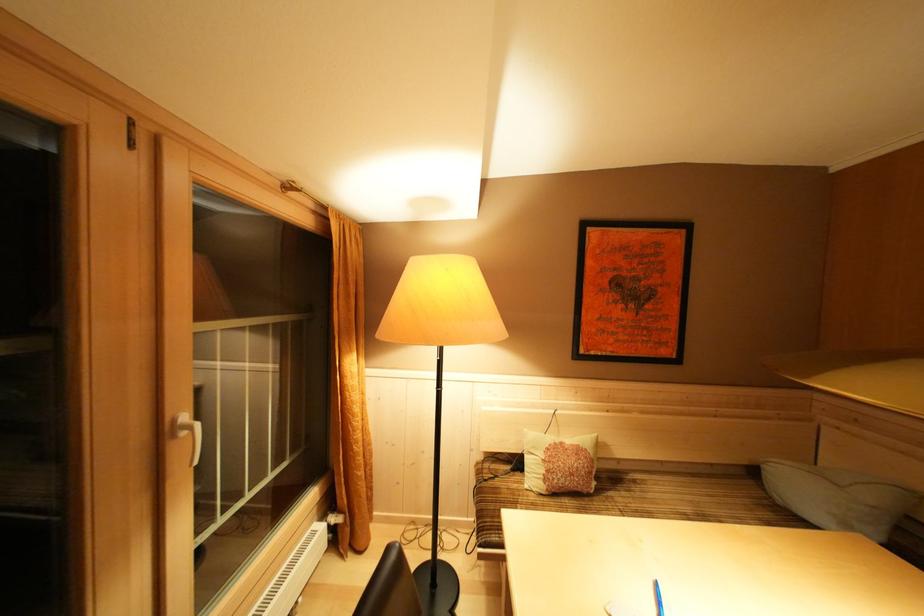
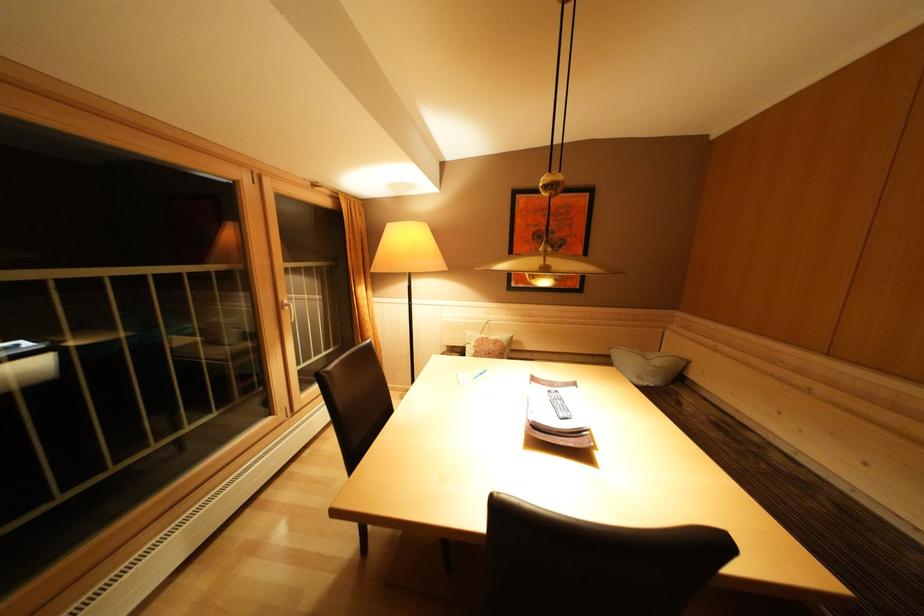
Question: The images are taken continuously from a first-person perspective. In which direction is your viewpoint rotating?

Choices:
 (A) Left
 (B) Right
 (C) Up
 (D) Down

Answer: (D)